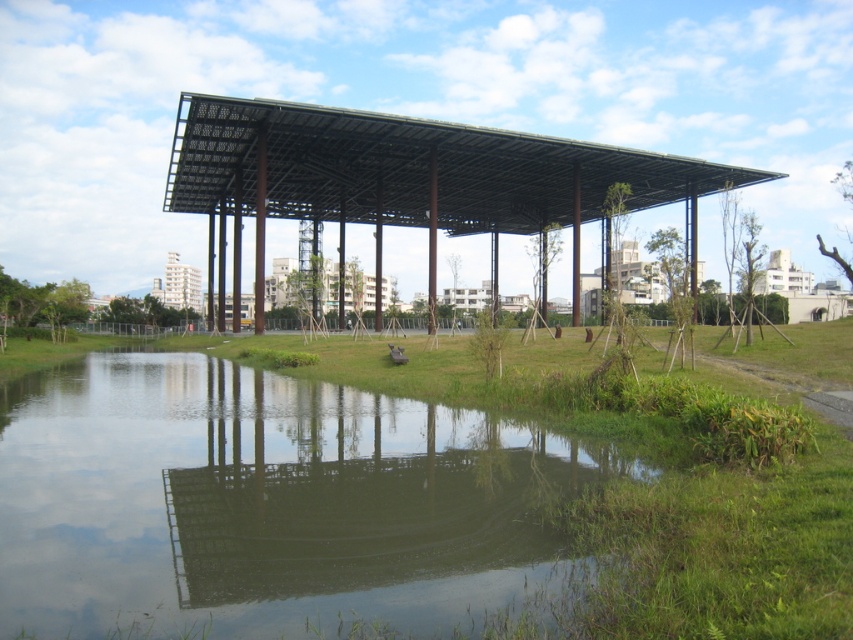
You are standing at the edge of the water and looking at the pavilion. There are two points marked on the structure. Which point is closer to you, point (15,433) or point (196,115)?

Point (15,433) is closer to the camera than point (196,115).

You are standing at the edge of the pavilion and want to see your reflection in the transparent water at center. Which direction should you look to see your reflection?

You should look downward toward the transparent water at center, as reflections are typically seen on the surface of water below your current position.